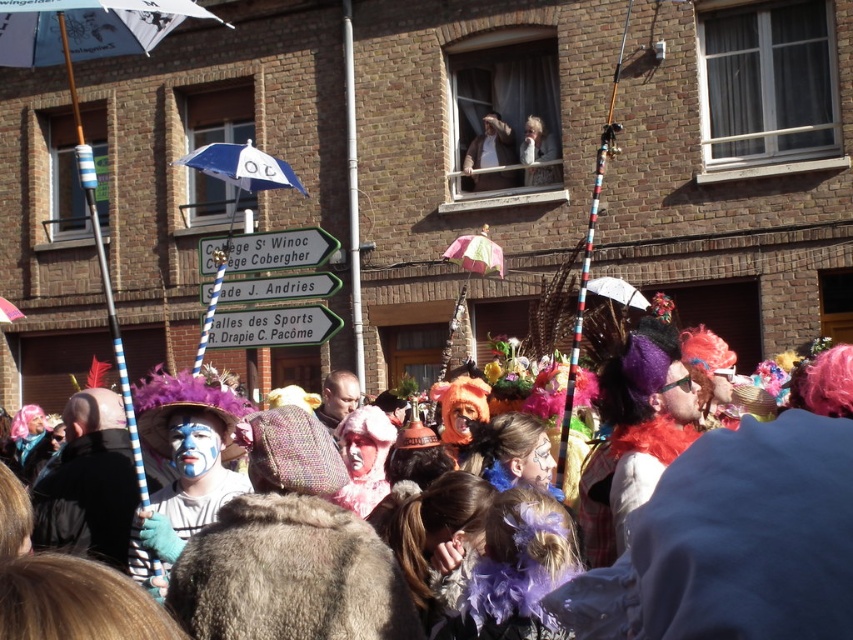
Does green plastic street sign at upper center appear on the right side of greensignboard at center?

No, green plastic street sign at upper center is not to the right of greensignboard at center.

Can you confirm if green plastic street sign at upper center is shorter than greensignboard at center?

Correct, green plastic street sign at upper center is not as tall as greensignboard at center.

Is point (206, 269) positioned behind point (218, 336)?

That is True.

Locate an element on the screen. Image resolution: width=853 pixels, height=640 pixels. green plastic street sign at upper center is located at coordinates pos(267,250).

Is white fabric umbrella at left bigger than light brown leather jacket at upper center?

Yes, white fabric umbrella at left is bigger than light brown leather jacket at upper center.

Does white fabric umbrella at left appear over light brown leather jacket at upper center?

No, white fabric umbrella at left is not above light brown leather jacket at upper center.

Which is in front, point (115, 3) or point (465, 168)?

Point (115, 3)

Image resolution: width=853 pixels, height=640 pixels. I want to click on white fabric umbrella at left, so coord(77,99).

Can you confirm if greensignboard at center is taller than light brown leather jacket at upper center?

No, greensignboard at center is not taller than light brown leather jacket at upper center.

Between greensignboard at center and light brown leather jacket at upper center, which one appears on the left side from the viewer's perspective?

greensignboard at center

Identify the location of greensignboard at center. (271, 326).

You are a GUI agent. You are given a task and a screenshot of the screen. Output one action in this format:
    pyautogui.click(x=<x>, y=<y>)
    Task: Click on the greensignboard at center
    Image resolution: width=853 pixels, height=640 pixels.
    Given the screenshot: What is the action you would take?
    click(x=271, y=326)